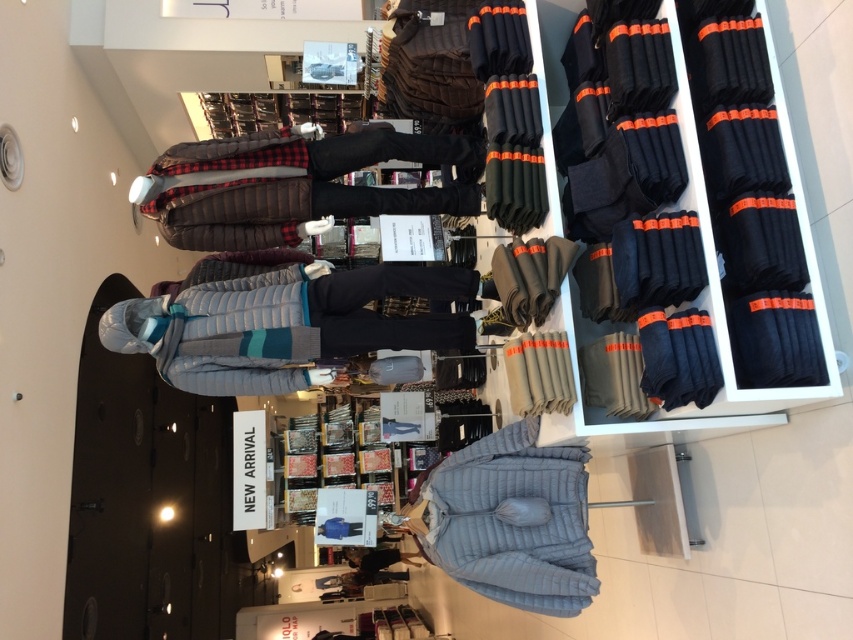
Between light gray quilted jacket at center and brown quilted jacket at center, which one has less height?

With less height is light gray quilted jacket at center.

Which is in front, point (184, 292) or point (469, 202)?

Point (184, 292) is more forward.

Locate an element on the screen. light gray quilted jacket at center is located at coordinates (285, 324).

Which is above, light gray quilted jacket at center or light blue quilted jacket at center?

light gray quilted jacket at center is above.

This screenshot has height=640, width=853. What do you see at coordinates (285, 324) in the screenshot? I see `light gray quilted jacket at center` at bounding box center [285, 324].

Describe the element at coordinates (285, 324) in the screenshot. This screenshot has width=853, height=640. I see `light gray quilted jacket at center` at that location.

At what (x,y) coordinates should I click in order to perform the action: click on light gray quilted jacket at center. Please return your answer as a coordinate pair (x, y). The height and width of the screenshot is (640, 853). Looking at the image, I should click on (285, 324).

Measure the distance between light blue quilted jacket at center and dark gray fleece pants at center.

light blue quilted jacket at center is 23.22 inches from dark gray fleece pants at center.

Is light blue quilted jacket at center shorter than dark gray fleece pants at center?

Incorrect, light blue quilted jacket at center's height does not fall short of dark gray fleece pants at center's.

Does point (492, 472) lie in front of point (554, 282)?

No, it is behind (554, 282).

Where is `light blue quilted jacket at center`? The height and width of the screenshot is (640, 853). light blue quilted jacket at center is located at coordinates (514, 522).